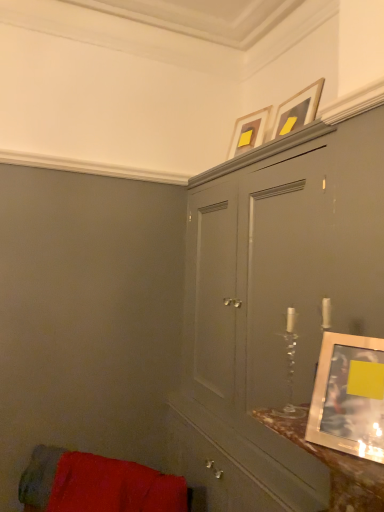
Locate an element on the screen. The height and width of the screenshot is (512, 384). metallic silver picture frame at right, the third picture frame positioned from the top is located at coordinates (349, 396).

How much space does matte gold picture frame at upper center, which ranks as the third picture frame in bottom-to-top order, occupy horizontally?

A: The width of matte gold picture frame at upper center, which ranks as the third picture frame in bottom-to-top order, is 9.92 inches.

At what (x,y) coordinates should I click in order to perform the action: click on metallic silver picture frame at right, the first picture frame from the front. Please return your answer as a coordinate pair (x, y). Looking at the image, I should click on tap(349, 396).

From a real-world perspective, who is located lower, matte gold picture frame at upper center, marked as the third picture frame in a front-to-back arrangement, or metallic silver picture frame at right, the first picture frame from the front?

In real-world perspective, metallic silver picture frame at right, the first picture frame from the front, is lower.

From the image's perspective, between matte gold picture frame at upper center, which ranks as the third picture frame in bottom-to-top order, and metallic silver picture frame at right, the third picture frame positioned from the top, which one is located above?

matte gold picture frame at upper center, which ranks as the third picture frame in bottom-to-top order, appears higher in the image.

Considering their positions, is matte gold picture frame at upper center, the first picture frame in the top-to-bottom sequence, located in front of or behind metallic silver picture frame at right, which is the first picture frame from bottom to top?

matte gold picture frame at upper center, the first picture frame in the top-to-bottom sequence, is behind metallic silver picture frame at right, which is the first picture frame from bottom to top.

From their relative heights in the image, would you say matte silver picture frame at upper center, which is the second picture frame in front-to-back order, is taller or shorter than matte gray cabinet at upper center?

Clearly, matte silver picture frame at upper center, which is the second picture frame in front-to-back order, is shorter compared to matte gray cabinet at upper center.

What are the coordinates of `picture frame that is the 2nd object located above the matte gray cabinet at upper center (from the image's perspective)` in the screenshot? It's located at (298, 110).

Who is smaller, velvet red cushion at lower left or metallic silver picture frame at right, the first picture frame from the front?

With smaller size is metallic silver picture frame at right, the first picture frame from the front.

From a real-world perspective, is velvet red cushion at lower left beneath metallic silver picture frame at right, the first picture frame from the front?

Yes, from a real-world perspective, velvet red cushion at lower left is below metallic silver picture frame at right, the first picture frame from the front.

Based on their positions, is velvet red cushion at lower left located to the left or right of metallic silver picture frame at right, the third picture frame positioned from the top?

Clearly, velvet red cushion at lower left is on the left of metallic silver picture frame at right, the third picture frame positioned from the top, in the image.

Between point (24, 479) and point (347, 342), which one is positioned behind?

The point (24, 479) is farther from the camera.

Are velvet red cushion at lower left and matte gray cabinet at upper center making contact?

There is a gap between velvet red cushion at lower left and matte gray cabinet at upper center.

Is matte gray cabinet at upper center completely or partially inside velvet red cushion at lower left?

No, matte gray cabinet at upper center is not surrounded by velvet red cushion at lower left.

Is velvet red cushion at lower left in front of matte gray cabinet at upper center?

That is False.

From the image's perspective, is matte gray cabinet at upper center positioned above or below matte gold picture frame at upper center, the first picture frame viewed from the back?

Clearly, from the image's perspective, matte gray cabinet at upper center is below matte gold picture frame at upper center, the first picture frame viewed from the back.

In the image, is matte gray cabinet at upper center positioned in front of or behind matte gold picture frame at upper center, marked as the third picture frame in a front-to-back arrangement?

Visually, matte gray cabinet at upper center is located in front of matte gold picture frame at upper center, marked as the third picture frame in a front-to-back arrangement.

In the image, is matte gray cabinet at upper center on the left side or the right side of matte gold picture frame at upper center, marked as the third picture frame in a front-to-back arrangement?

In the image, matte gray cabinet at upper center appears on the right side of matte gold picture frame at upper center, marked as the third picture frame in a front-to-back arrangement.

Considering the sizes of objects matte gray cabinet at upper center and velvet red cushion at lower left in the image provided, who is wider, matte gray cabinet at upper center or velvet red cushion at lower left?

Wider between the two is matte gray cabinet at upper center.

Consider the image. How different are the orientations of matte gray cabinet at upper center and velvet red cushion at lower left in degrees?

46 degrees.

From the image's perspective, is matte gray cabinet at upper center over velvet red cushion at lower left?

Yes, from the image's perspective, matte gray cabinet at upper center is on top of velvet red cushion at lower left.

Would you say matte gray cabinet at upper center is a long distance from velvet red cushion at lower left?

matte gray cabinet at upper center is near velvet red cushion at lower left, not far away.

How many degrees apart are the facing directions of matte silver picture frame at upper center, which is the second picture frame in front-to-back order, and velvet red cushion at lower left?

50.3 degrees separate the facing orientations of matte silver picture frame at upper center, which is the second picture frame in front-to-back order, and velvet red cushion at lower left.

You are a GUI agent. You are given a task and a screenshot of the screen. Output one action in this format:
    pyautogui.click(x=<x>, y=<y>)
    Task: Click on the furniture lying on the left of matte silver picture frame at upper center, marked as the 2th picture frame in a top-to-bottom arrangement
    
    Given the screenshot: What is the action you would take?
    pyautogui.click(x=42, y=476)

Is matte silver picture frame at upper center, which is the second picture frame in front-to-back order, positioned beyond the bounds of velvet red cushion at lower left?

Yes, matte silver picture frame at upper center, which is the second picture frame in front-to-back order, is outside of velvet red cushion at lower left.

Considering the sizes of matte silver picture frame at upper center, the second picture frame when ordered from back to front, and velvet red cushion at lower left in the image, is matte silver picture frame at upper center, the second picture frame when ordered from back to front, wider or thinner than velvet red cushion at lower left?

matte silver picture frame at upper center, the second picture frame when ordered from back to front, is thinner than velvet red cushion at lower left.

This screenshot has width=384, height=512. I want to click on the 2nd picture frame behind the metallic silver picture frame at right, which is the third picture frame in back-to-front order, counting from the anchor's position, so click(248, 132).

There is a matte gray cabinet at upper center. Identify the location of the 2nd picture frame above it (from a real-world perspective). Image resolution: width=384 pixels, height=512 pixels. (298, 110).

From the image, which object appears to be nearer to matte silver picture frame at upper center, the second picture frame when ordered from back to front, matte gold picture frame at upper center, marked as the third picture frame in a front-to-back arrangement, or metallic silver picture frame at right, which is the third picture frame in back-to-front order?

Among the two, matte gold picture frame at upper center, marked as the third picture frame in a front-to-back arrangement, is located nearer to matte silver picture frame at upper center, the second picture frame when ordered from back to front.

From the image, which object appears to be farther from metallic silver picture frame at right, the first picture frame from the front, matte gold picture frame at upper center, the first picture frame in the top-to-bottom sequence, or matte silver picture frame at upper center, which is the second picture frame in front-to-back order?

matte gold picture frame at upper center, the first picture frame in the top-to-bottom sequence, lies further to metallic silver picture frame at right, the first picture frame from the front, than the other object.

Estimate the real-world distances between objects in this image. Which object is closer to velvet red cushion at lower left, metallic silver picture frame at right, which is the third picture frame in back-to-front order, or matte gold picture frame at upper center, the first picture frame viewed from the back?

Among the two, metallic silver picture frame at right, which is the third picture frame in back-to-front order, is located nearer to velvet red cushion at lower left.

Based on the photo, looking at the image, which one is located further to velvet red cushion at lower left, metallic silver picture frame at right, the first picture frame from the front, or matte gray cabinet at upper center?

Among the two, metallic silver picture frame at right, the first picture frame from the front, is located further to velvet red cushion at lower left.

From the picture: Which object lies nearer to the anchor point matte silver picture frame at upper center, which is the second picture frame in front-to-back order, metallic silver picture frame at right, which is the third picture frame in back-to-front order, or matte gray cabinet at upper center?

matte gray cabinet at upper center is closer to matte silver picture frame at upper center, which is the second picture frame in front-to-back order.

Which object lies nearer to the anchor point velvet red cushion at lower left, matte gray cabinet at upper center or matte gold picture frame at upper center, marked as the third picture frame in a front-to-back arrangement?

matte gray cabinet at upper center lies closer to velvet red cushion at lower left than the other object.

Estimate the real-world distances between objects in this image. Which object is further from matte gray cabinet at upper center, matte gold picture frame at upper center, the first picture frame in the top-to-bottom sequence, or matte silver picture frame at upper center, marked as the 2th picture frame in a top-to-bottom arrangement?

matte gold picture frame at upper center, the first picture frame in the top-to-bottom sequence, is further to matte gray cabinet at upper center.

Which object lies nearer to the anchor point velvet red cushion at lower left, matte gray cabinet at upper center or matte silver picture frame at upper center, which is the second picture frame in front-to-back order?

matte gray cabinet at upper center is positioned closer to the anchor velvet red cushion at lower left.

What are the coordinates of `cabinetry between matte silver picture frame at upper center, marked as the 2th picture frame in a top-to-bottom arrangement, and velvet red cushion at lower left from top to bottom` in the screenshot? It's located at (274, 306).

I want to click on cabinetry between matte gold picture frame at upper center, marked as the third picture frame in a front-to-back arrangement, and velvet red cushion at lower left, in the vertical direction, so click(x=274, y=306).

Locate an element on the screen. The height and width of the screenshot is (512, 384). picture frame that lies between matte silver picture frame at upper center, positioned as the second picture frame in bottom-to-top order, and matte gray cabinet at upper center from top to bottom is located at coordinates (349, 396).

You are a GUI agent. You are given a task and a screenshot of the screen. Output one action in this format:
    pyautogui.click(x=<x>, y=<y>)
    Task: Click on the cabinetry between velvet red cushion at lower left and metallic silver picture frame at right, which is the third picture frame in back-to-front order
    
    Given the screenshot: What is the action you would take?
    pyautogui.click(x=274, y=306)